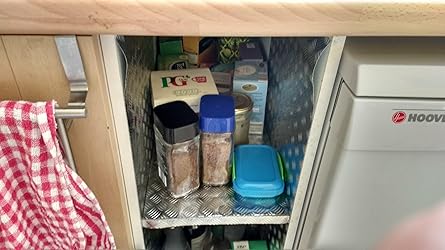
In order to click on towel rack in this screenshot , I will do `click(68, 69)`.